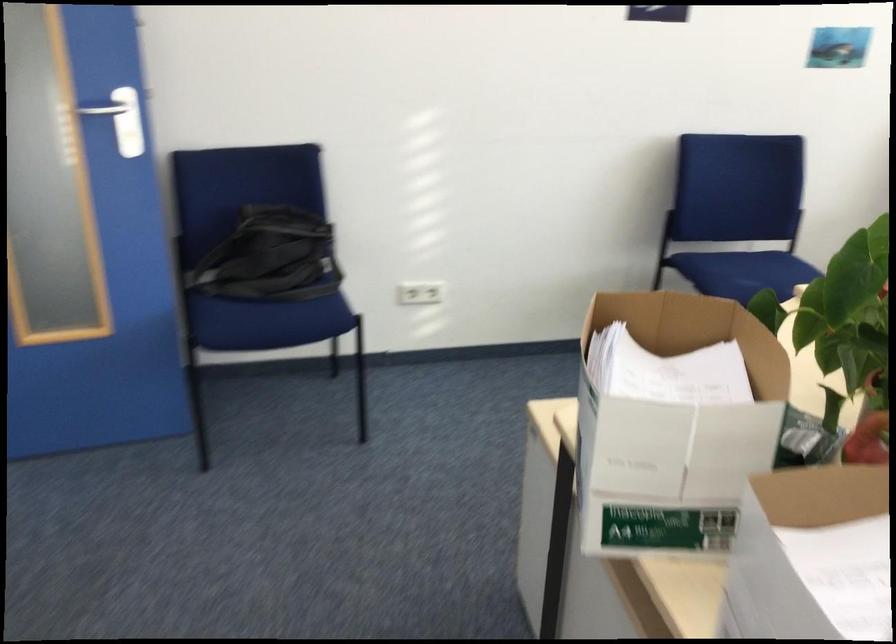
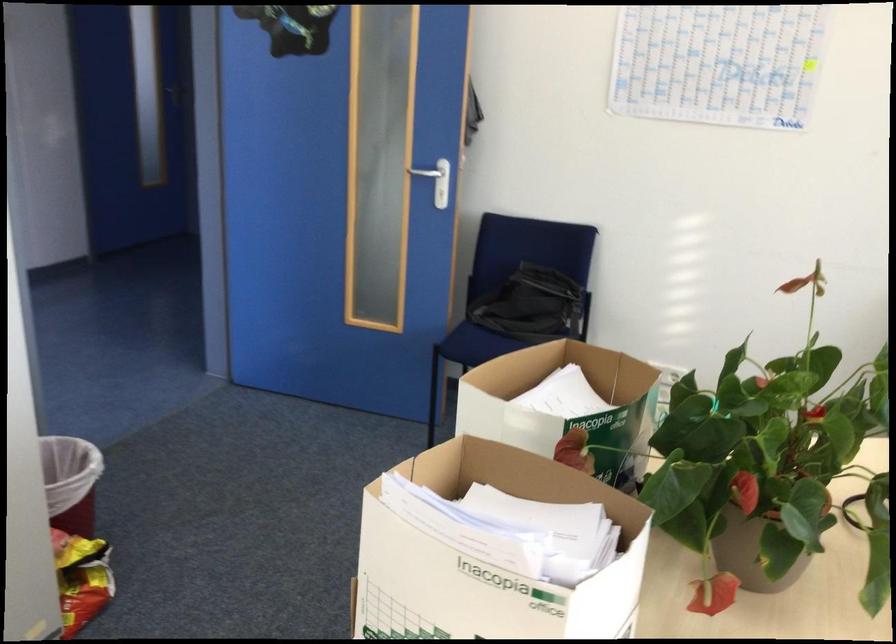
In the second image, find the point that corresponds to (x=107, y=122) in the first image.

(424, 172)